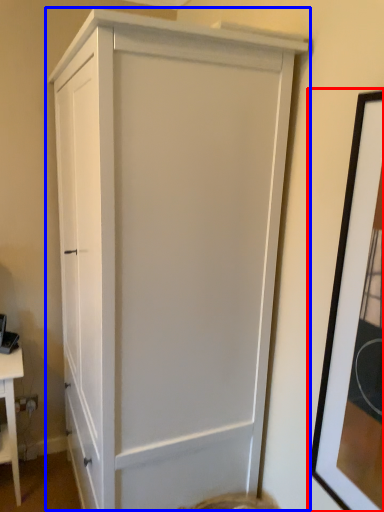
Question: Which object is further to the camera taking this photo, picture frame (highlighted by a red box) or cupboard (highlighted by a blue box)?

Choices:
 (A) picture frame
 (B) cupboard

Answer: (B)